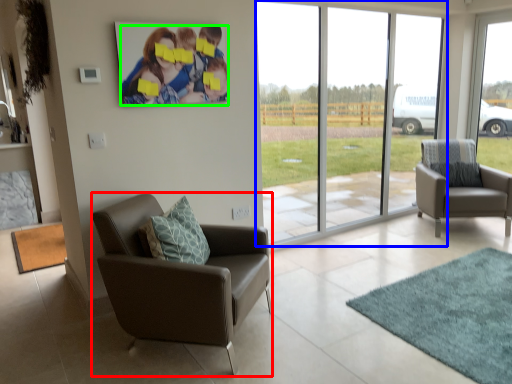
Question: Which object is the farthest from chair (highlighted by a red box)? Choose among these: window (highlighted by a blue box) or couple (highlighted by a green box).

Choices:
 (A) window
 (B) couple

Answer: (A)